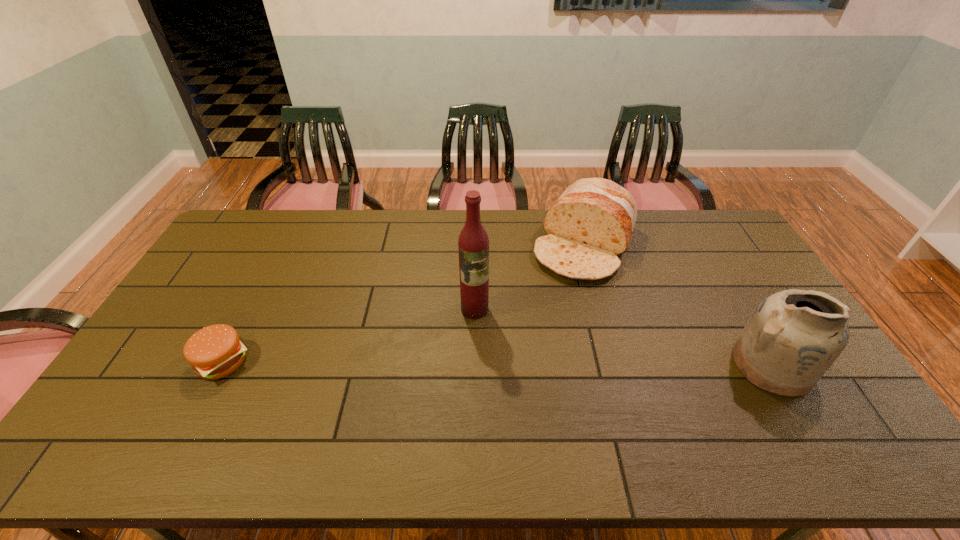
At what (x,y) coordinates should I click in order to perform the action: click on object that is at the near right corner. Please return your answer as a coordinate pair (x, y). This screenshot has width=960, height=540. Looking at the image, I should click on (794, 336).

Find the location of `vacant space at the far edge of the desktop`. vacant space at the far edge of the desktop is located at coordinates (528, 238).

At what (x,y) coordinates should I click in order to perform the action: click on free spot at the near edge of the desktop. Please return your answer as a coordinate pair (x, y). The height and width of the screenshot is (540, 960). Looking at the image, I should click on pos(314,394).

You are a GUI agent. You are given a task and a screenshot of the screen. Output one action in this format:
    pyautogui.click(x=<x>, y=<y>)
    Task: Click on the vacant point at the left edge
    
    Given the screenshot: What is the action you would take?
    pyautogui.click(x=175, y=343)

Identify the location of free space at the right edge of the desktop. (759, 294).

In the image, there is a desktop. Where is `vacant region at the far left corner`? vacant region at the far left corner is located at coordinates point(269,224).

Where is `free space at the near left corner`? Image resolution: width=960 pixels, height=540 pixels. free space at the near left corner is located at coordinates (152, 400).

This screenshot has width=960, height=540. In order to click on vacant space at the near right corner in this screenshot , I will do `click(786, 400)`.

Locate an element on the screen. The width and height of the screenshot is (960, 540). vacant space in between the tallest object and the hamburger is located at coordinates (348, 335).

Find the location of a particular element. Image resolution: width=960 pixels, height=540 pixels. free space between the third nearest object and the second shortest object is located at coordinates (530, 277).